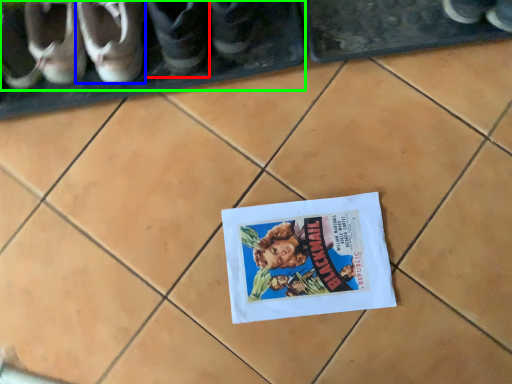
Question: Which is farther away from footwear (highlighted by a red box)? footwear (highlighted by a blue box) or footwear (highlighted by a green box)?

Choices:
 (A) footwear
 (B) footwear

Answer: (B)